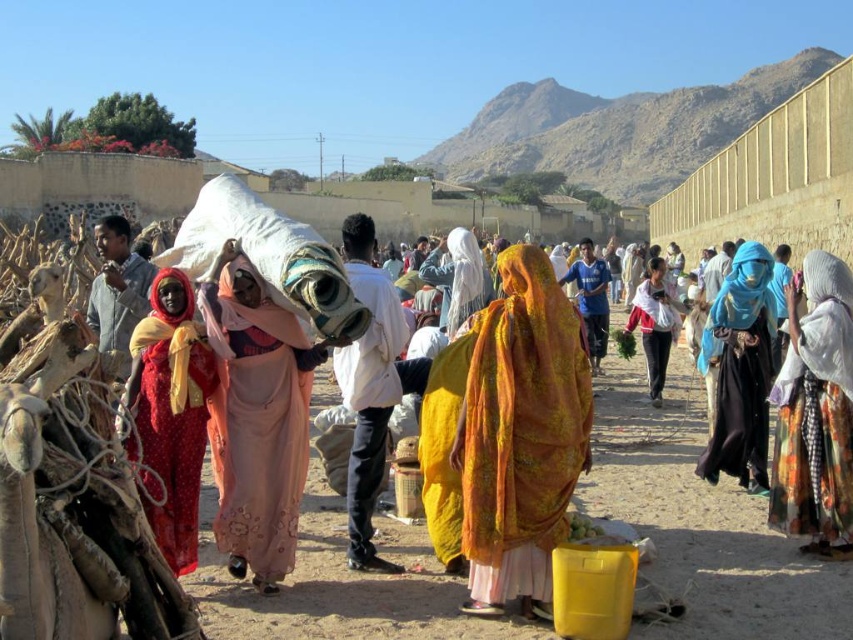
Does floral fabric dress at center have a greater width compared to white fabric headscarf at center?

No, floral fabric dress at center is not wider than white fabric headscarf at center.

Is point (798, 476) positioned in front of point (492, 289)?

Yes.

Identify the location of floral fabric dress at center. This screenshot has height=640, width=853. (815, 413).

Does blue sheer scarf at center have a lesser height compared to white fabric headscarf at center?

Incorrect, blue sheer scarf at center's height does not fall short of white fabric headscarf at center's.

In order to click on blue sheer scarf at center in this screenshot , I will do `click(740, 369)`.

This screenshot has height=640, width=853. What are the coordinates of `blue sheer scarf at center` in the screenshot? It's located at (740, 369).

Is floral fabric dress at center wider than white cotton bag at center?

In fact, floral fabric dress at center might be narrower than white cotton bag at center.

Can you confirm if floral fabric dress at center is taller than white cotton bag at center?

Yes.

Which is behind, point (817, 321) or point (654, 284)?

The point (654, 284) is more distant.

You are a GUI agent. You are given a task and a screenshot of the screen. Output one action in this format:
    pyautogui.click(x=<x>, y=<y>)
    Task: Click on the floral fabric dress at center
    This screenshot has height=640, width=853.
    Given the screenshot: What is the action you would take?
    pyautogui.click(x=815, y=413)